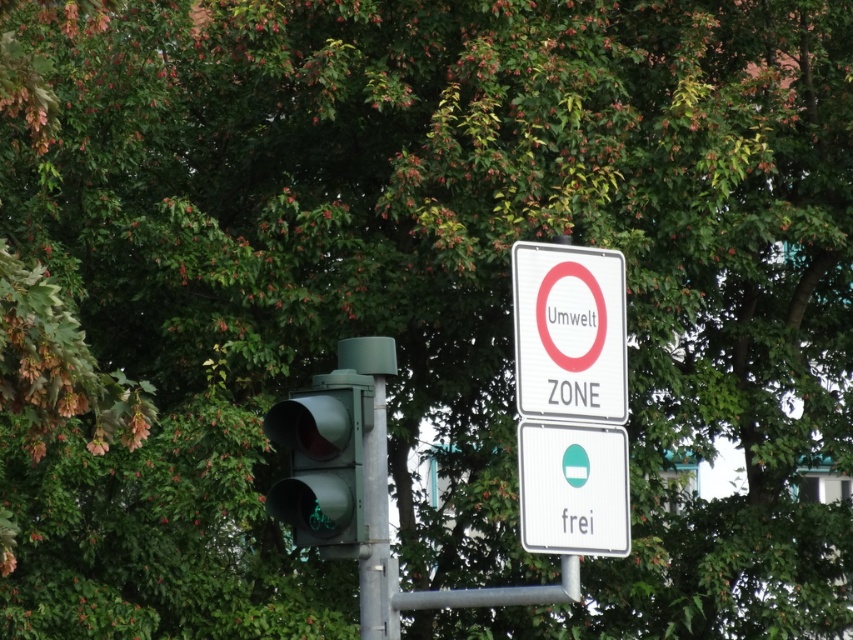
Question: Which point is farther from the camera taking this photo?

Choices:
 (A) (309, 522)
 (B) (601, 518)
 (C) (579, 316)

Answer: (C)

Question: Does green matte traffic light at center appear on the left side of white plastic sign at center?

Choices:
 (A) yes
 (B) no

Answer: (A)

Question: Which object is positioned farthest from the white plastic sign at center?

Choices:
 (A) white plastic sign at upper center
 (B) green matte traffic light at center

Answer: (B)

Question: Which point appears closest to the camera in this image?

Choices:
 (A) (567, 301)
 (B) (351, 419)
 (C) (608, 490)

Answer: (B)

Question: Is white plastic sign at upper center to the right of green matte traffic light at center from the viewer's perspective?

Choices:
 (A) no
 (B) yes

Answer: (B)

Question: Can you confirm if white plastic sign at upper center is positioned to the left of green matte traffic light at center?

Choices:
 (A) no
 (B) yes

Answer: (A)